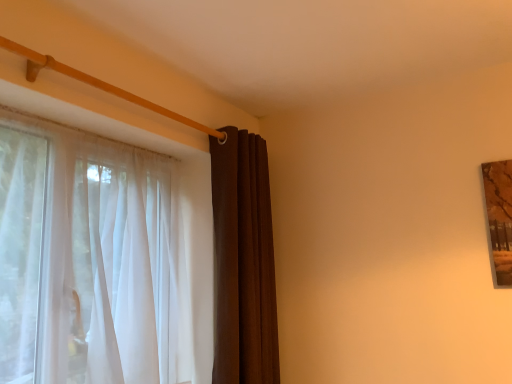
Question: From the image's perspective, is brown velvet curtain at center, the first curtain when ordered from right to left, beneath sheer white curtain at left, which ranks as the second curtain in right-to-left order?

Choices:
 (A) no
 (B) yes

Answer: (B)

Question: Is brown velvet curtain at center, the first curtain when ordered from right to left, not near sheer white curtain at left, which is the first curtain in left-to-right order?

Choices:
 (A) yes
 (B) no

Answer: (B)

Question: From a real-world perspective, is brown velvet curtain at center, acting as the second curtain starting from the left, over sheer white curtain at left, which is the first curtain in left-to-right order?

Choices:
 (A) yes
 (B) no

Answer: (A)

Question: Can you see brown velvet curtain at center, the first curtain when ordered from right to left, touching sheer white curtain at left, which is the first curtain in left-to-right order?

Choices:
 (A) no
 (B) yes

Answer: (A)

Question: Is the position of brown velvet curtain at center, acting as the second curtain starting from the left, less distant than that of sheer white curtain at left, which ranks as the second curtain in right-to-left order?

Choices:
 (A) no
 (B) yes

Answer: (A)

Question: Would you say brown velvet curtain at center, the first curtain when ordered from right to left, is outside sheer white curtain at left, which ranks as the second curtain in right-to-left order?

Choices:
 (A) yes
 (B) no

Answer: (A)

Question: From a real-world perspective, is sheer white curtain at left, which ranks as the second curtain in right-to-left order, under brown velvet curtain at center, acting as the second curtain starting from the left?

Choices:
 (A) yes
 (B) no

Answer: (A)

Question: Can you confirm if sheer white curtain at left, which ranks as the second curtain in right-to-left order, is wider than brown velvet curtain at center, acting as the second curtain starting from the left?

Choices:
 (A) yes
 (B) no

Answer: (A)

Question: Considering the relative positions of sheer white curtain at left, which is the first curtain in left-to-right order, and brown velvet curtain at center, acting as the second curtain starting from the left, in the image provided, is sheer white curtain at left, which is the first curtain in left-to-right order, to the left of brown velvet curtain at center, acting as the second curtain starting from the left, from the viewer's perspective?

Choices:
 (A) yes
 (B) no

Answer: (A)

Question: From a real-world perspective, is sheer white curtain at left, which is the first curtain in left-to-right order, positioned over brown velvet curtain at center, the first curtain when ordered from right to left, based on gravity?

Choices:
 (A) yes
 (B) no

Answer: (B)

Question: Considering the relative sizes of sheer white curtain at left, which ranks as the second curtain in right-to-left order, and brown velvet curtain at center, acting as the second curtain starting from the left, in the image provided, is sheer white curtain at left, which ranks as the second curtain in right-to-left order, smaller than brown velvet curtain at center, acting as the second curtain starting from the left,?

Choices:
 (A) no
 (B) yes

Answer: (A)

Question: Is sheer white curtain at left, which ranks as the second curtain in right-to-left order, not within brown velvet curtain at center, the first curtain when ordered from right to left?

Choices:
 (A) no
 (B) yes

Answer: (B)

Question: Looking at their shapes, would you say brown velvet curtain at center, acting as the second curtain starting from the left, is wider or thinner than sheer white curtain at left, which is the first curtain in left-to-right order?

Choices:
 (A) wide
 (B) thin

Answer: (B)